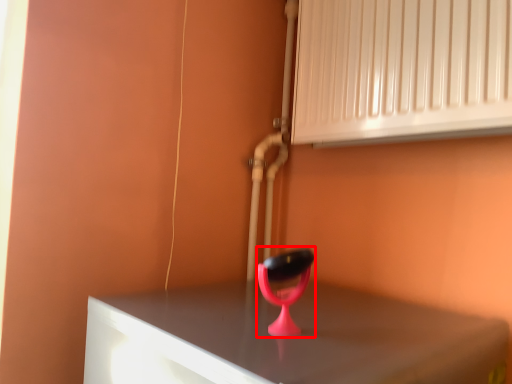
Question: Observing the image, what is the correct spatial positioning of table lamp (annotated by the red box) in reference to air conditioning?

Choices:
 (A) right
 (B) left

Answer: (B)